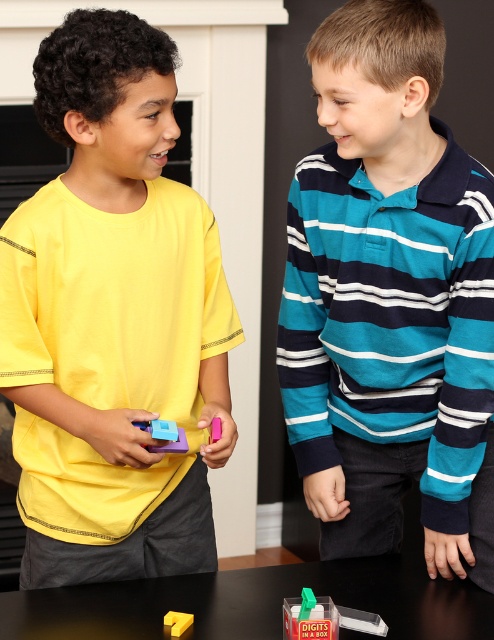
You are a child trying to reach both the matte plastic toy at center and the pink plastic smartphone at center on the table. Which one should you reach for first if you want the one closer to you?

The matte plastic toy at center is to the left of the pink plastic smartphone at center, so if you are facing the table, the matte plastic toy at center would be closer to your left hand, making it easier to reach first.

You are a parent observing two children playing with building blocks. The children are wearing a matte yellow shirt at left and a teal striped shirt at center. Which child is taking up more space in the scene?

The teal striped shirt at center occupies more space than the matte yellow shirt at left, so the child wearing the teal striped shirt at center is taking up more space in the scene.